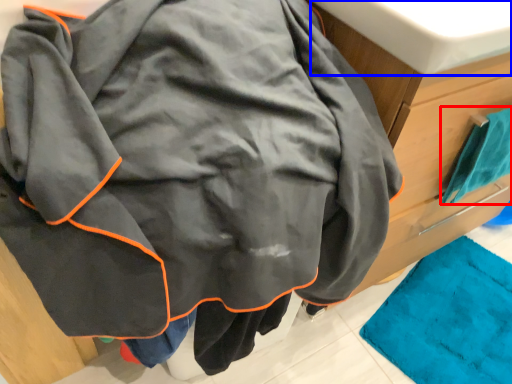
Question: Which object appears closest to the camera in this image, towel (highlighted by a red box) or sink (highlighted by a blue box)?

Choices:
 (A) towel
 (B) sink

Answer: (B)